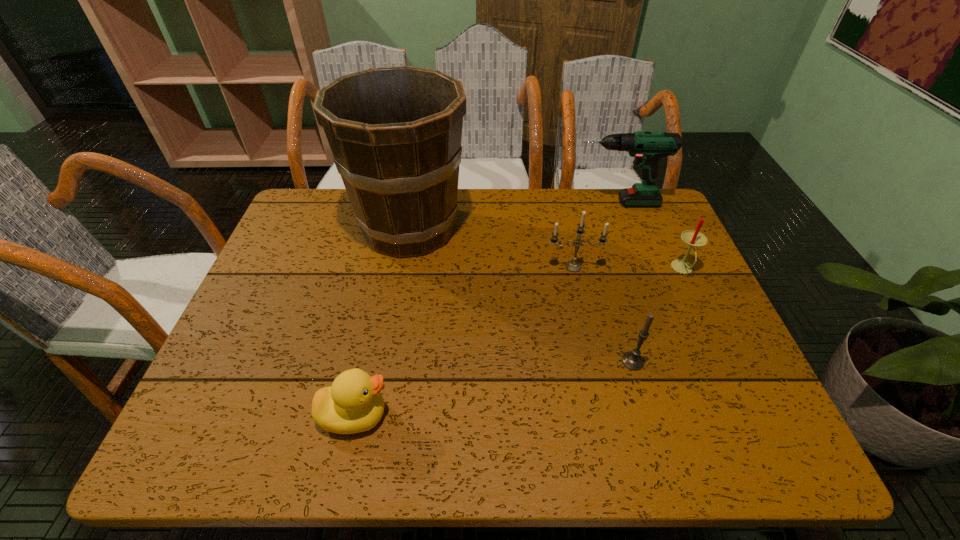
The height and width of the screenshot is (540, 960). I want to click on the tallest object, so click(x=395, y=133).

You are a GUI agent. You are given a task and a screenshot of the screen. Output one action in this format:
    pyautogui.click(x=<x>, y=<y>)
    Task: Click on the drill
    The height and width of the screenshot is (540, 960).
    Given the screenshot: What is the action you would take?
    pyautogui.click(x=648, y=148)

I want to click on the rightmost candle, so click(x=693, y=238).

Where is `the nearest candle`? Image resolution: width=960 pixels, height=540 pixels. the nearest candle is located at coordinates (632, 360).

The height and width of the screenshot is (540, 960). Identify the location of the shortest object. (353, 404).

The image size is (960, 540). Identify the location of duck. (353, 404).

Find the location of a particular element. The width and height of the screenshot is (960, 540). vacant space located 0.350m on the front of the tallest object is located at coordinates (381, 388).

Find the location of a particular element. The image size is (960, 540). vacant region located on the handle side of the second tallest object is located at coordinates (530, 203).

At what (x,y) coordinates should I click in order to perform the action: click on vacant space located 0.310m on the handle side of the second tallest object. Please return your answer as a coordinate pair (x, y). Looking at the image, I should click on (471, 203).

Locate an element on the screen. blank area located 0.240m on the handle side of the second tallest object is located at coordinates (494, 203).